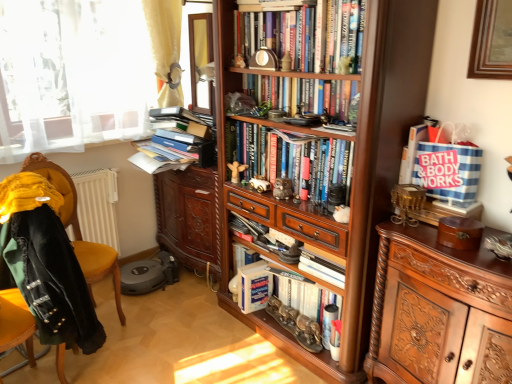
Question: From their relative heights in the image, would you say blue striped tote bag at upper right, the 4th book from the top, is taller or shorter than matte brown owl at center, arranged as the 3th toy when viewed from the back?

Choices:
 (A) tall
 (B) short

Answer: (A)

Question: From a real-world perspective, is blue striped tote bag at upper right, the second book in the bottom-to-top sequence, above or below matte brown owl at center, which is counted as the 1th toy, starting from the right?

Choices:
 (A) above
 (B) below

Answer: (A)

Question: Which is nearer to the metallic gold car at center, acting as the 2th toy starting from the front?

Choices:
 (A) metallic silver magazine at center
 (B) matte brown owl at center, arranged as the 3th toy when viewed from the back
 (C) polished wood cabinet at right
 (D) hardcover books at center, the first book positioned from the top
 (E) wooden bookshelf at center, the third book positioned from the bottom

Answer: (B)

Question: Which of these objects is positioned farthest from the metallic gold car at center, which is the 2th toy from back to front?

Choices:
 (A) matte brown owl at center, the 1th toy positioned from the front
 (B) polished wood cabinet at right
 (C) hardcover books at center, marked as the 4th book in a bottom-to-top arrangement
 (D) velvet yellow chair at left
 (E) hardcover books at center, which is counted as the fifth book, starting from the bottom

Answer: (D)